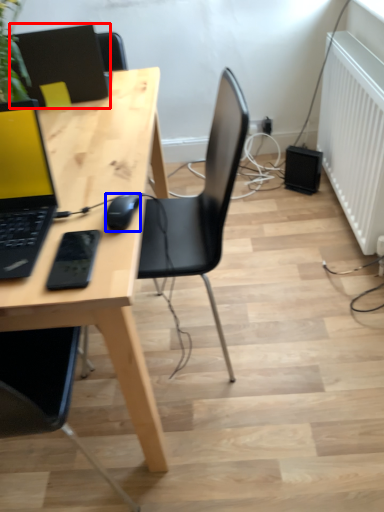
Question: Which point is further to the camera, laptop (highlighted by a red box) or mouse (highlighted by a blue box)?

Choices:
 (A) laptop
 (B) mouse

Answer: (A)